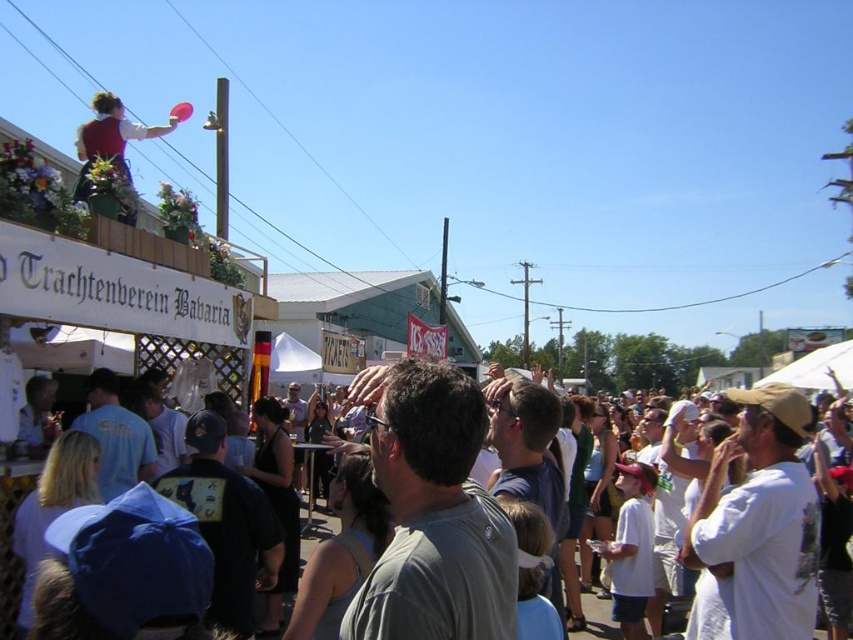
Question: Is matte red vest at upper left closer to the viewer compared to white cotton crowd at center?

Choices:
 (A) yes
 (B) no

Answer: (B)

Question: Where is gray matte shirt at center located in relation to matte red vest at upper left in the image?

Choices:
 (A) below
 (B) above

Answer: (A)

Question: Which point is farther from the camera taking this photo?

Choices:
 (A) coord(602,604)
 (B) coord(502,532)
 (C) coord(102,124)

Answer: (A)

Question: Which object appears farthest from the camera in this image?

Choices:
 (A) gray matte shirt at center
 (B) white cotton crowd at center

Answer: (B)

Question: Which point is farther from the camera taking this photo?

Choices:
 (A) (453, 508)
 (B) (305, 554)
 (C) (78, 145)

Answer: (B)

Question: Does gray matte shirt at center have a larger size compared to matte red vest at upper left?

Choices:
 (A) no
 (B) yes

Answer: (A)